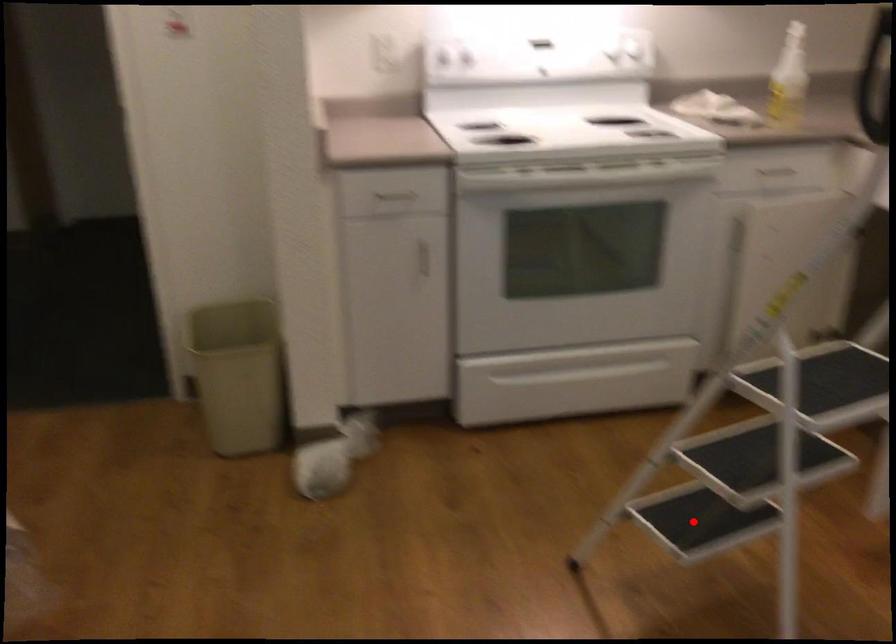
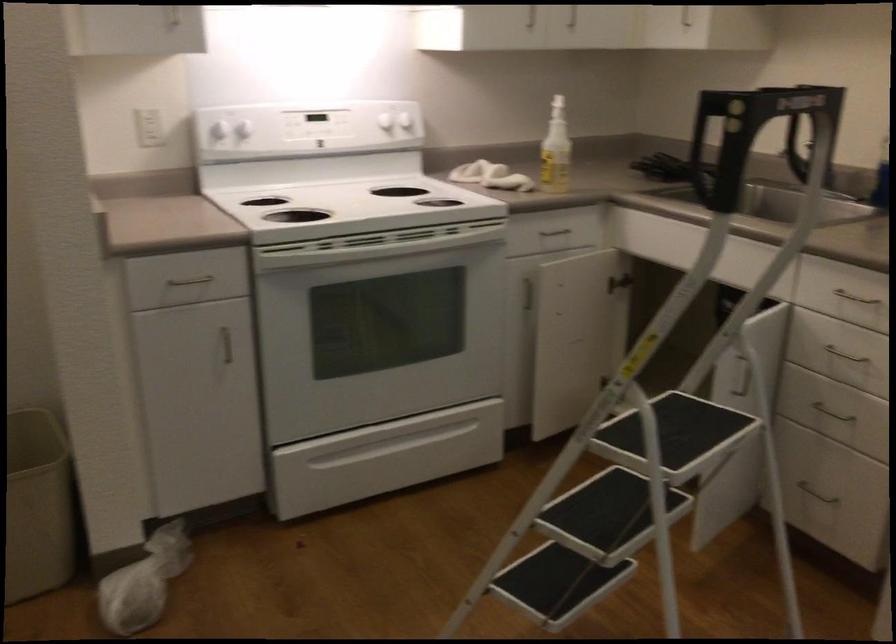
Find the pixel in the second image that matches the highlighted location in the first image.

(556, 583)